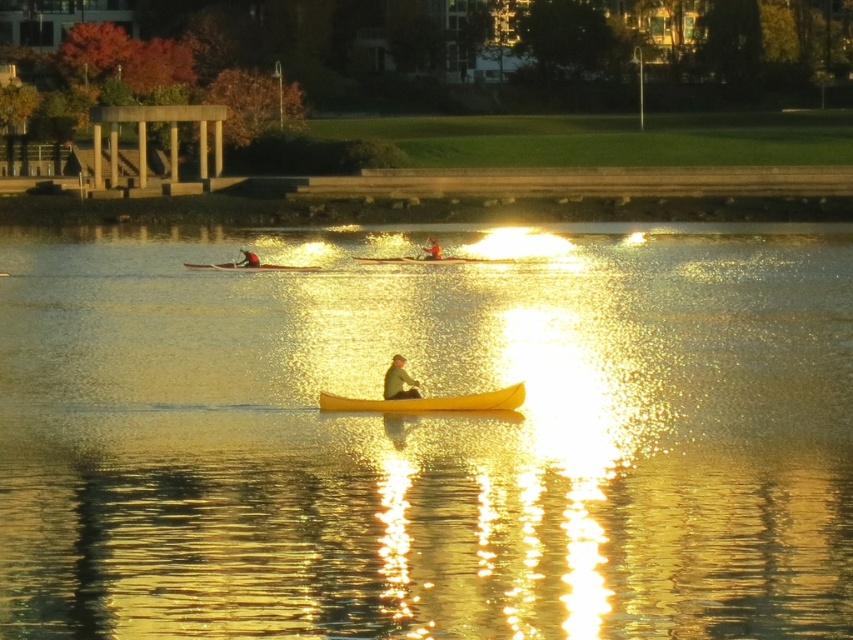
Question: Is green fabric jacket at center thinner than matte black kayak at center?

Choices:
 (A) no
 (B) yes

Answer: (B)

Question: Is yellow matte canoe at center closer to the viewer compared to green fabric jacket at center?

Choices:
 (A) no
 (B) yes

Answer: (B)

Question: Considering the real-world distances, which object is closest to the matte black canoe at center?

Choices:
 (A) yellow smooth water at center
 (B) matte black kayak at center
 (C) green fabric jacket at center

Answer: (B)

Question: Estimate the real-world distances between objects in this image. Which object is closer to the yellow smooth water at center?

Choices:
 (A) matte black kayak at center
 (B) yellow matte canoe at center

Answer: (B)

Question: Among these points, which one is farthest from the camera?

Choices:
 (A) (0, 636)
 (B) (242, 259)
 (C) (393, 365)

Answer: (B)

Question: Where is yellow smooth water at center located in relation to green fabric jacket at center in the image?

Choices:
 (A) below
 (B) above

Answer: (B)